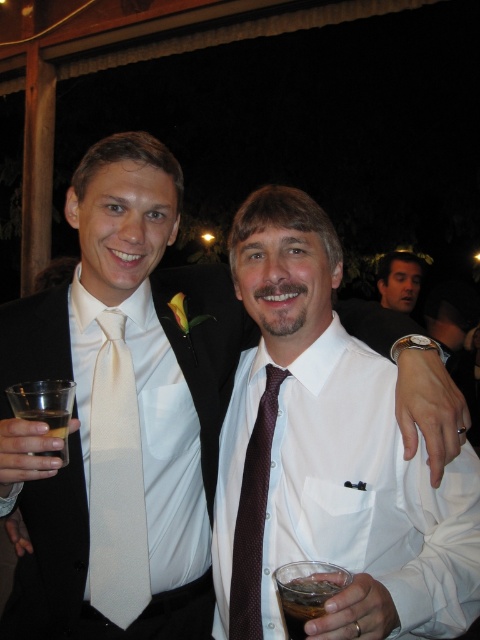
Question: Which is farther from the translucent plastic cup at lower left?

Choices:
 (A) dark brown liquid at lower center
 (B) smooth skin face at upper right
 (C) brown dotted tie at center
 (D) white satin tie at center

Answer: (B)

Question: Among these objects, which one is nearest to the camera?

Choices:
 (A) white satin tie at center
 (B) smooth skin face at upper right
 (C) translucent plastic cup at lower left

Answer: (C)

Question: Observing the image, what is the correct spatial positioning of white satin dress shirt at center in reference to smooth skin face at upper right?

Choices:
 (A) left
 (B) right

Answer: (A)

Question: Is brown dotted tie at center above translucent plastic cup at lower left?

Choices:
 (A) yes
 (B) no

Answer: (B)

Question: Which of these objects is positioned farthest from the brown dotted tie at center?

Choices:
 (A) smooth skin face at upper right
 (B) white satin tie at center

Answer: (A)

Question: Does white satin tie at center appear on the right side of dark brown liquid at lower center?

Choices:
 (A) yes
 (B) no

Answer: (B)